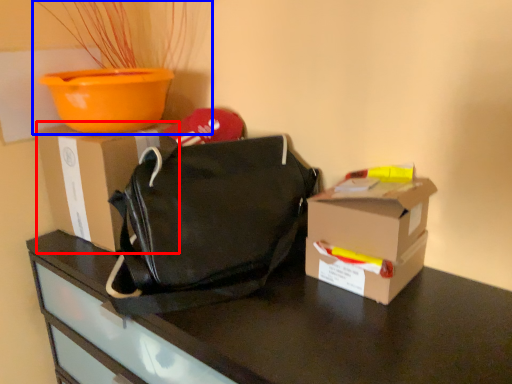
Question: Which of the following is the closest to the observer, box (highlighted by a red box) or houseplant (highlighted by a blue box)?

Choices:
 (A) box
 (B) houseplant

Answer: (B)